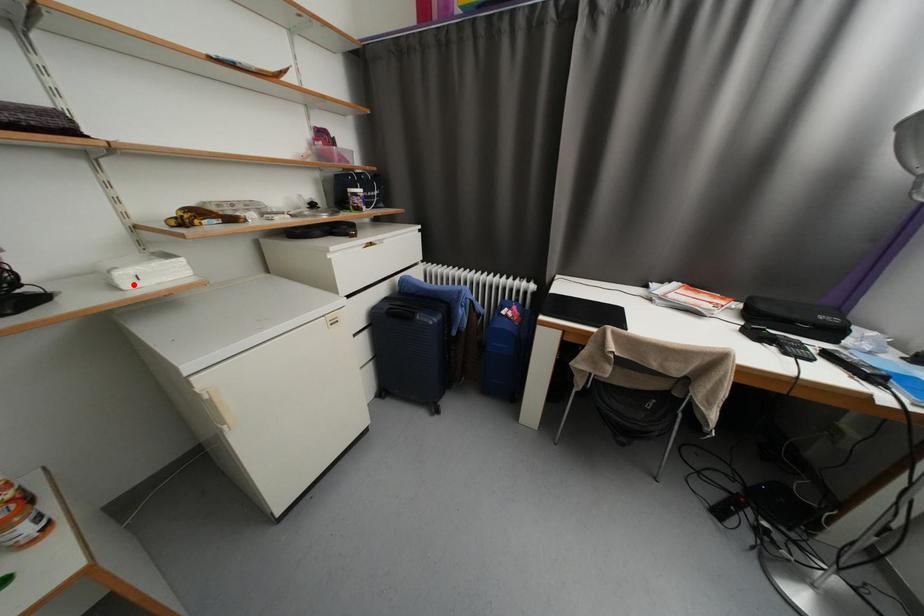
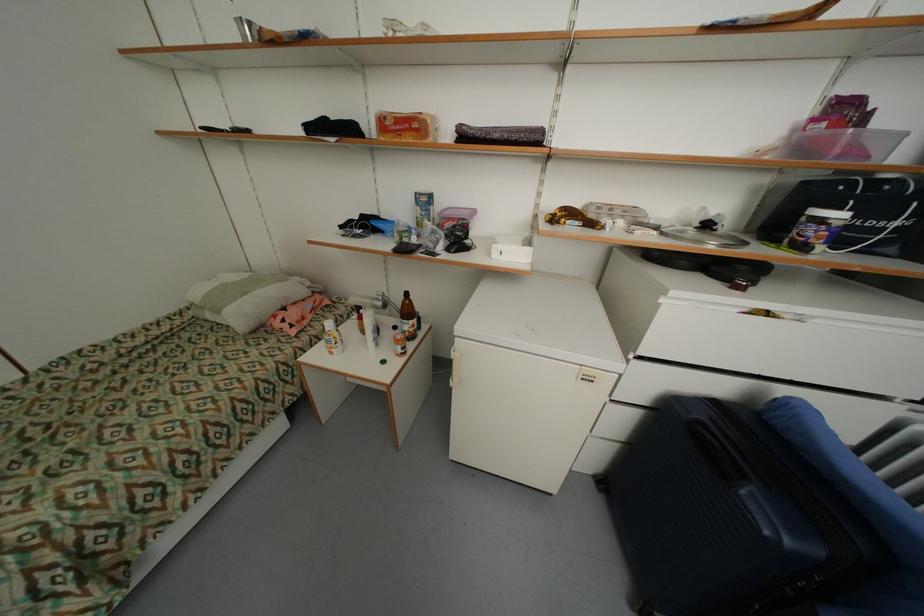
In the second image, find the point that corresponds to the highlighted location in the first image.

(502, 256)